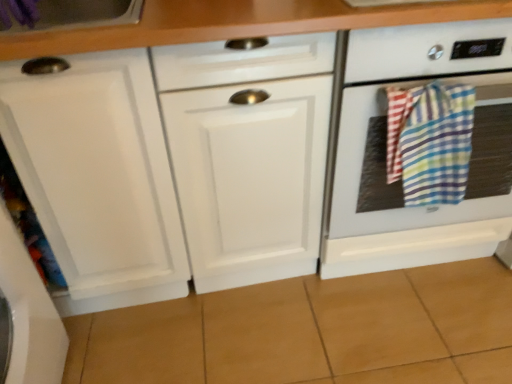
Question: Would you say white glossy oven at right is outside multicolored plaid towel at right?

Choices:
 (A) yes
 (B) no

Answer: (A)

Question: Is white glossy oven at right positioned behind multicolored plaid towel at right?

Choices:
 (A) yes
 (B) no

Answer: (B)

Question: Is white glossy oven at right taller than multicolored plaid towel at right?

Choices:
 (A) no
 (B) yes

Answer: (B)

Question: Is white glossy oven at right facing towards multicolored plaid towel at right?

Choices:
 (A) no
 (B) yes

Answer: (B)

Question: Does white glossy oven at right have a smaller size compared to multicolored plaid towel at right?

Choices:
 (A) yes
 (B) no

Answer: (B)

Question: From the image's perspective, is white glossy oven at right under multicolored plaid towel at right?

Choices:
 (A) yes
 (B) no

Answer: (B)

Question: Is multicolored plaid towel at right completely or partially outside of white glossy oven at right?

Choices:
 (A) yes
 (B) no

Answer: (A)

Question: Is multicolored plaid towel at right oriented towards white glossy oven at right?

Choices:
 (A) yes
 (B) no

Answer: (B)

Question: Can you confirm if multicolored plaid towel at right is bigger than white glossy oven at right?

Choices:
 (A) yes
 (B) no

Answer: (B)

Question: Can you confirm if multicolored plaid towel at right is positioned to the left of white glossy oven at right?

Choices:
 (A) no
 (B) yes

Answer: (B)

Question: From a real-world perspective, is multicolored plaid towel at right positioned over white glossy oven at right based on gravity?

Choices:
 (A) no
 (B) yes

Answer: (B)

Question: Can you confirm if multicolored plaid towel at right is positioned to the right of white glossy oven at right?

Choices:
 (A) yes
 (B) no

Answer: (B)

Question: From a real-world perspective, is white glossy oven at right positioned above or below multicolored plaid towel at right?

Choices:
 (A) above
 (B) below

Answer: (B)